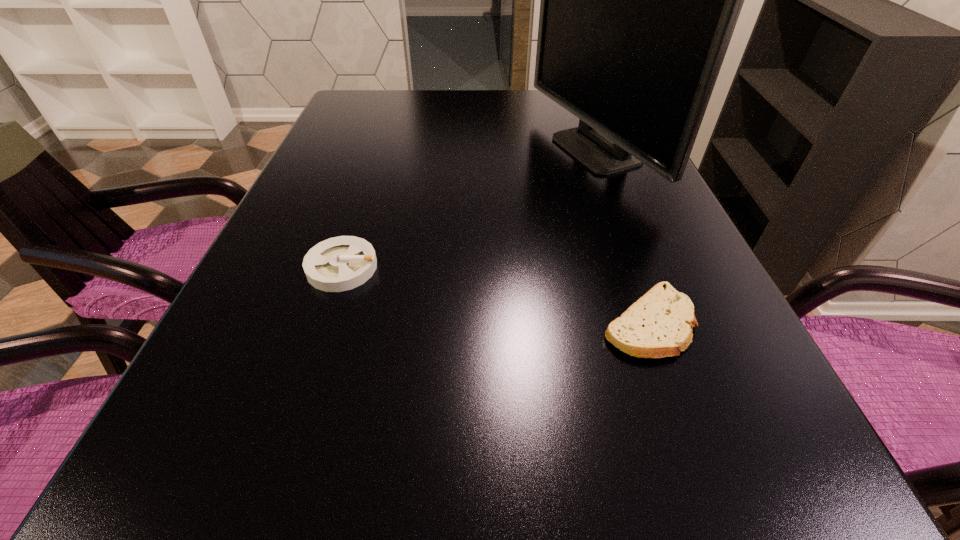
Where is `vacant space in between the shortest object and the computer monitor`? This screenshot has height=540, width=960. vacant space in between the shortest object and the computer monitor is located at coordinates (619, 237).

The image size is (960, 540). In order to click on empty space between the farthest object and the second shortest object in this screenshot , I will do `click(467, 209)`.

In order to click on vacant area that lies between the ashtray and the pita bread in this screenshot , I will do `click(495, 295)`.

This screenshot has height=540, width=960. I want to click on free space between the second shortest object and the pita bread, so click(x=495, y=295).

Find the location of `unoccupied area between the tallest object and the pita bread`. unoccupied area between the tallest object and the pita bread is located at coordinates (619, 237).

Identify the location of empty location between the pita bread and the second shortest object. Image resolution: width=960 pixels, height=540 pixels. click(x=495, y=295).

This screenshot has height=540, width=960. I want to click on free spot between the pita bread and the second shortest object, so click(495, 295).

Where is `vacant space in between the shortest object and the leftmost object`? This screenshot has width=960, height=540. vacant space in between the shortest object and the leftmost object is located at coordinates (495, 295).

Identify the location of empty space that is in between the shortest object and the farthest object. (619, 237).

Select which object is the second closest to the farthest object. Please provide its 2D coordinates. Your answer should be formatted as a tuple, i.e. [(x, y)], where the tuple contains the x and y coordinates of a point satisfying the conditions above.

[(337, 264)]